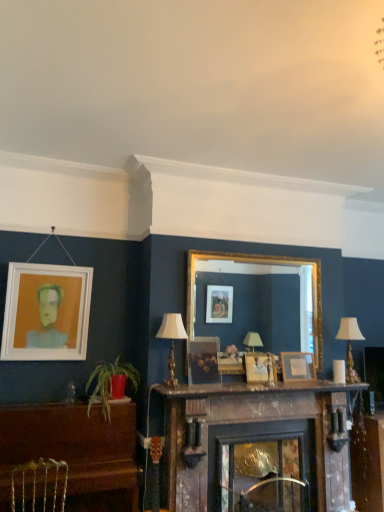
At what (x,y) coordinates should I click in order to perform the action: click on free space above gold-framed mirror at center (from a real-world perspective). Please return your answer as a coordinate pair (x, y). This screenshot has height=512, width=384. Looking at the image, I should click on (254, 250).